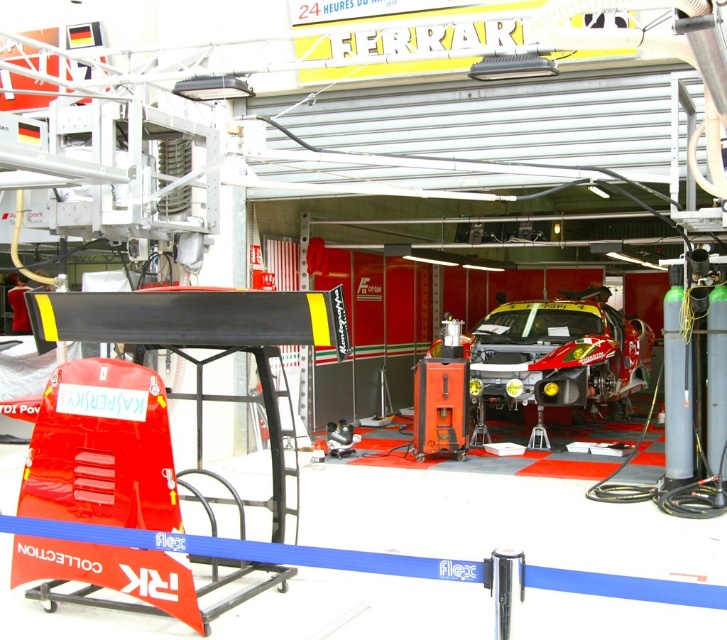
Question: Is shiny silver car at center closer to camera compared to metallic silver mechanic at center?

Choices:
 (A) no
 (B) yes

Answer: (B)

Question: Which point appears farthest from the camera in this image?

Choices:
 (A) (24, 312)
 (B) (469, 392)

Answer: (A)

Question: Can you confirm if shiny silver car at center is bigger than metallic silver mechanic at center?

Choices:
 (A) no
 (B) yes

Answer: (B)

Question: Does shiny silver car at center have a smaller size compared to metallic silver mechanic at center?

Choices:
 (A) yes
 (B) no

Answer: (B)

Question: Which point appears closest to the camera in this image?

Choices:
 (A) (590, 301)
 (B) (12, 296)

Answer: (A)

Question: Which object appears farthest from the camera in this image?

Choices:
 (A) shiny silver car at center
 (B) metallic silver mechanic at center

Answer: (B)